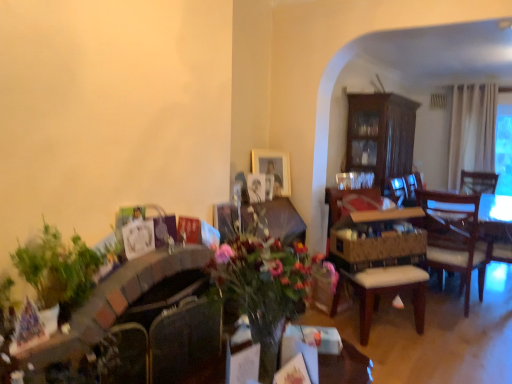
Question: Considering the positions of wooden cushioned chair at center and wooden armchair at center in the image, is wooden cushioned chair at center taller or shorter than wooden armchair at center?

Choices:
 (A) short
 (B) tall

Answer: (B)

Question: In the image, is wooden cushioned chair at center positioned in front of or behind wooden armchair at center?

Choices:
 (A) front
 (B) behind

Answer: (A)

Question: Which of these objects is positioned farthest from the wooden armchair at center?

Choices:
 (A) wooden table at center
 (B) green leafy plant at left
 (C) wooden cushioned chair at center
 (D) transparent glass window screen at upper right
 (E) dark wood cabinet at center-right

Answer: (D)

Question: Estimate the real-world distances between objects in this image. Which object is farther from the gold metallic picture frame at upper center?

Choices:
 (A) wooden cushioned chair at center
 (B) transparent glass window screen at upper right
 (C) green leafy plant at left
 (D) wooden armchair at center
 (E) wooden table at center

Answer: (B)